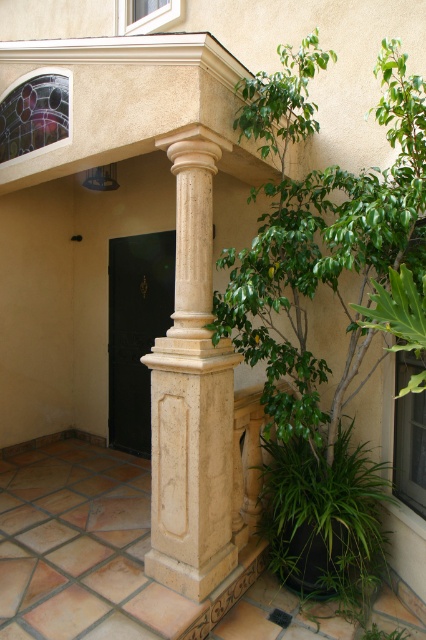
Question: Is beige stone column at center positioned at the back of black polished door at center?

Choices:
 (A) yes
 (B) no

Answer: (B)

Question: Considering the relative positions of beige stone column at center and green leafy plant at lower right in the image provided, where is beige stone column at center located with respect to green leafy plant at lower right?

Choices:
 (A) above
 (B) below

Answer: (A)

Question: Which point is closer to the camera?

Choices:
 (A) beige stone column at center
 (B) black polished door at center
 (C) green leafy plant at lower right

Answer: (A)

Question: Which point is farther to the camera?

Choices:
 (A) green leafy plant at lower right
 (B) beige stone column at center
 (C) black polished door at center

Answer: (C)

Question: Which of the following is the farthest from the observer?

Choices:
 (A) (368, 488)
 (B) (135, 358)
 (C) (166, 564)

Answer: (B)

Question: Can you confirm if beige stone column at center is positioned to the right of black polished door at center?

Choices:
 (A) yes
 (B) no

Answer: (A)